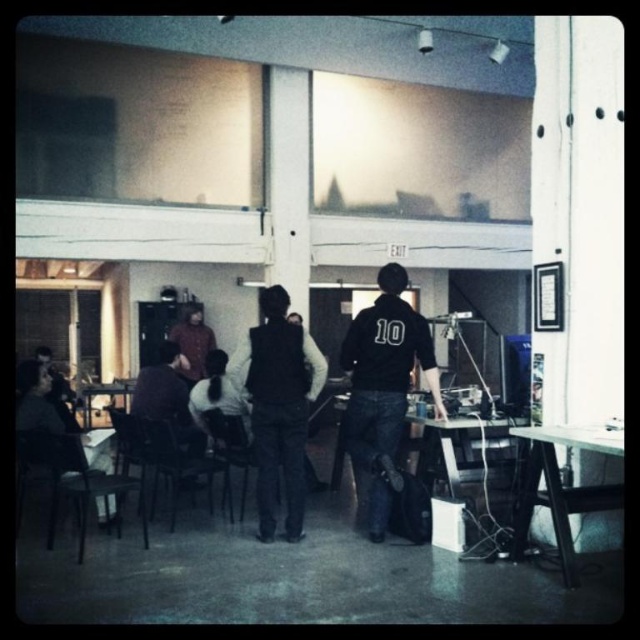
Question: Is black matte vest at center positioned before matte brown jacket at center?

Choices:
 (A) yes
 (B) no

Answer: (A)

Question: Which of the following is the farthest from the observer?

Choices:
 (A) black matte vest at center
 (B) black matte jacket at center
 (C) matte brown jacket at center
 (D) dark brown leather jacket at center

Answer: (C)

Question: Which is nearer to the black matte jacket at center?

Choices:
 (A) white glossy table at lower right
 (B) matte brown jacket at center
 (C) dark brown leather jacket at center

Answer: (A)

Question: Which point is farther to the camera?

Choices:
 (A) (372, 426)
 (B) (310, 385)
 (C) (173, 380)
 (D) (557, 509)

Answer: (C)

Question: Does white glossy table at lower right appear on the right side of dark brown leather jacket at center?

Choices:
 (A) no
 (B) yes

Answer: (B)

Question: Does black matte jacket at center come behind white glossy table at lower right?

Choices:
 (A) yes
 (B) no

Answer: (A)